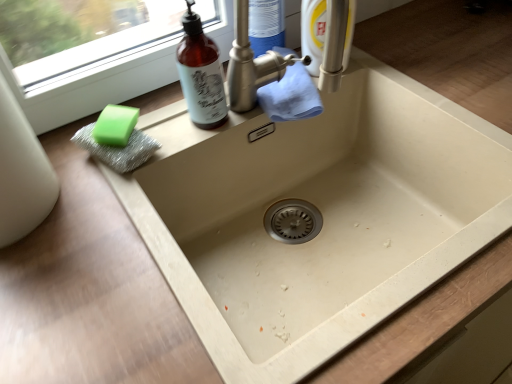
The height and width of the screenshot is (384, 512). In order to click on vacant region in front of green sponge at left in this screenshot , I will do `click(95, 226)`.